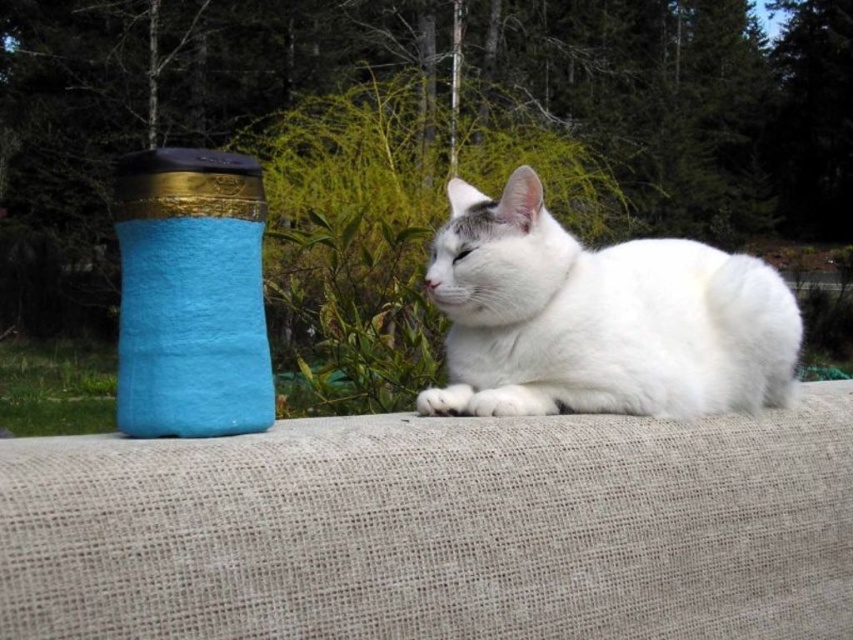
Which is behind, point (372, 481) or point (491, 371)?

The point (491, 371) is more distant.

From the picture: Does beige fabric couch at center lie behind white fluffy cat at center?

No, beige fabric couch at center is closer to the viewer.

Identify the location of beige fabric couch at center. The width and height of the screenshot is (853, 640). (438, 529).